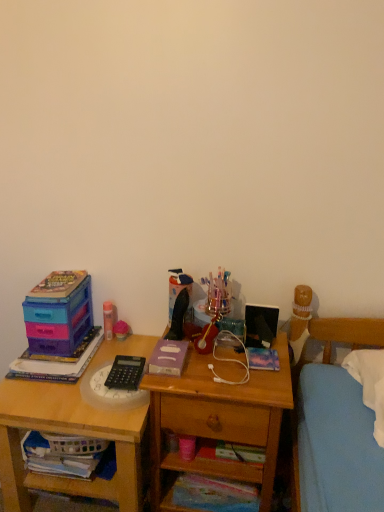
What are the coordinates of `vacant region to the left of black plastic calculator at center, placed as the 1th stationery when sorted from bottom to top` in the screenshot? It's located at (52, 390).